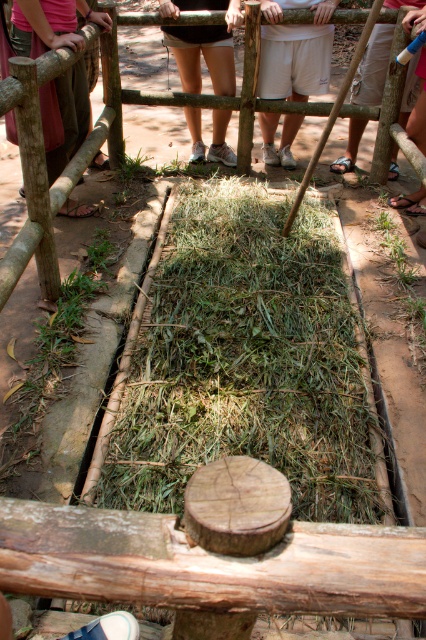
You are a photographer trying to capture a clear photo of the white cotton shorts at center without the brown wooden fence at center blocking the view. Can you move forward to achieve this?

The brown wooden fence at center is behind the white cotton shorts at center, so moving forward would bring the white cotton shorts at center closer but the fence would still be behind it. To avoid the fence blocking the view, you need to move sideways or adjust your angle rather than moving forward.

You are one of the people standing behind the wooden fence observing the grave. You want to place a small offering on the green grassy hay at center. Can you reach it without stepping onto the white cotton shorts at center?

The green grassy hay at center is closer to the viewer than the white cotton shorts at center, so you can reach the green grassy hay at center without stepping onto the white cotton shorts at center.

You are a photographer trying to capture the brown wooden post at center and the brown leather sandal at lower right in the same frame. Based on their sizes, which object would appear smaller in the photo?

The brown wooden post at center would appear smaller in the photo because it has a lesser height compared to the brown leather sandal at lower right.